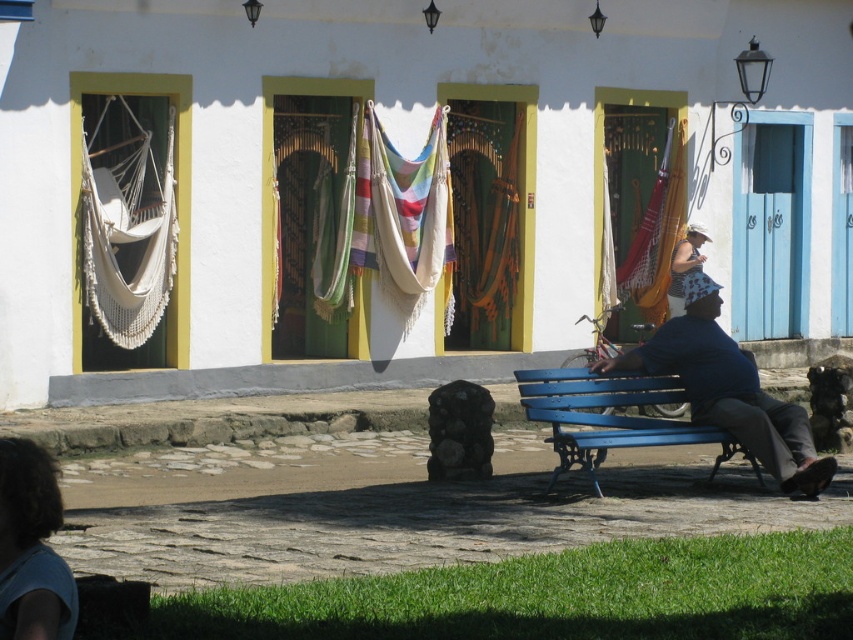
Question: Which of the following is the farthest from the observer?

Choices:
 (A) light brown hair at lower left
 (B) blue fabric shirt at lower right
 (C) striped fabric dress at center

Answer: (C)

Question: Does blue fabric shirt at lower right appear over light brown hair at lower left?

Choices:
 (A) no
 (B) yes

Answer: (B)

Question: Among these points, which one is farthest from the camera?

Choices:
 (A) (19, 568)
 (B) (677, 435)
 (C) (674, 250)

Answer: (C)

Question: Is white macrame hammock at left further to camera compared to blue painted wood bench at lower right?

Choices:
 (A) no
 (B) yes

Answer: (B)

Question: Does white macrame hammock at left appear under blue painted wood bench at lower right?

Choices:
 (A) no
 (B) yes

Answer: (A)

Question: Which of the following is the closest to the observer?

Choices:
 (A) blue painted wood bench at lower right
 (B) striped fabric dress at center

Answer: (A)